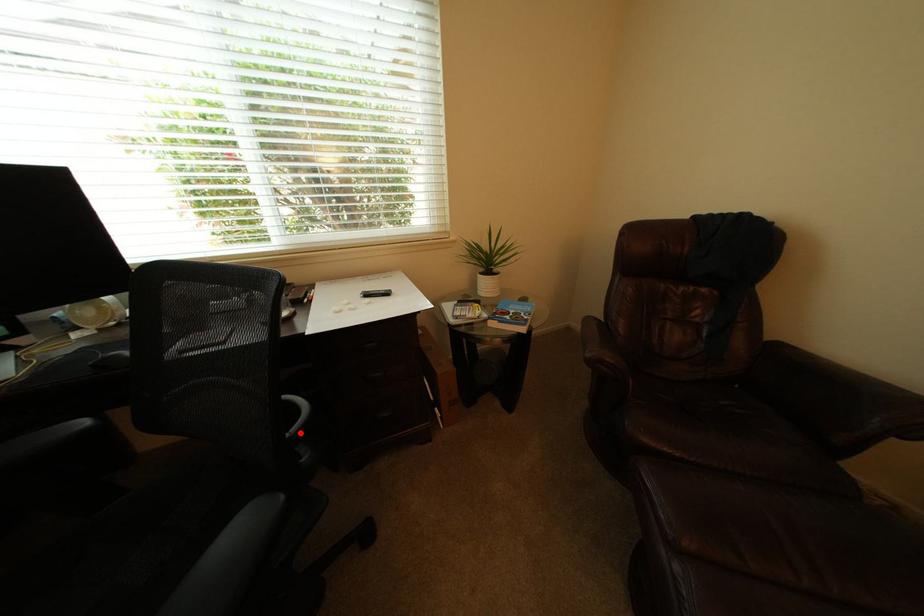
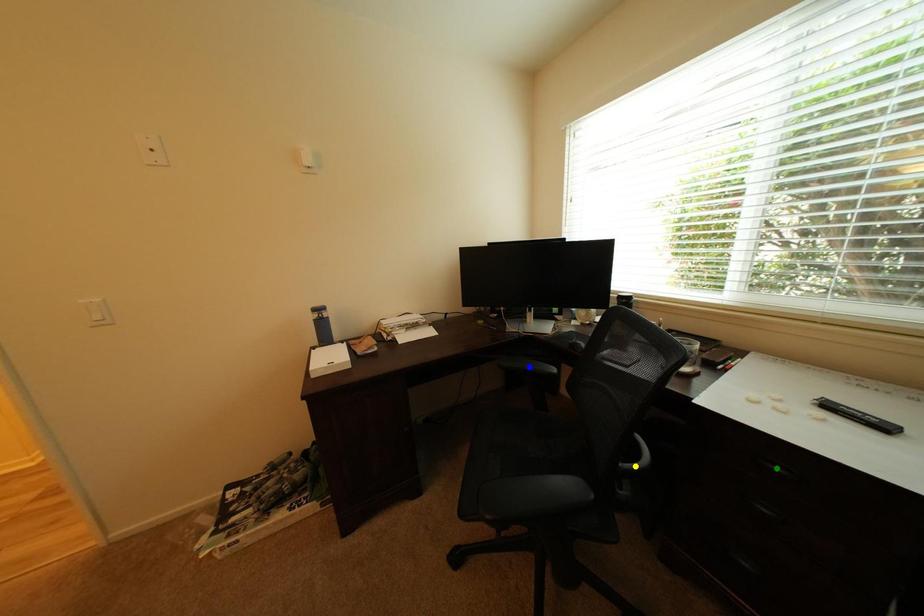
Question: I am providing you with two images of the same scene from different viewpoints. A red point is marked on the first image. You are given multiple points on the second image. Which mark in image 2 goes with the point in image 1?

Choices:
 (A) yellow point
 (B) blue point
 (C) green point

Answer: (A)